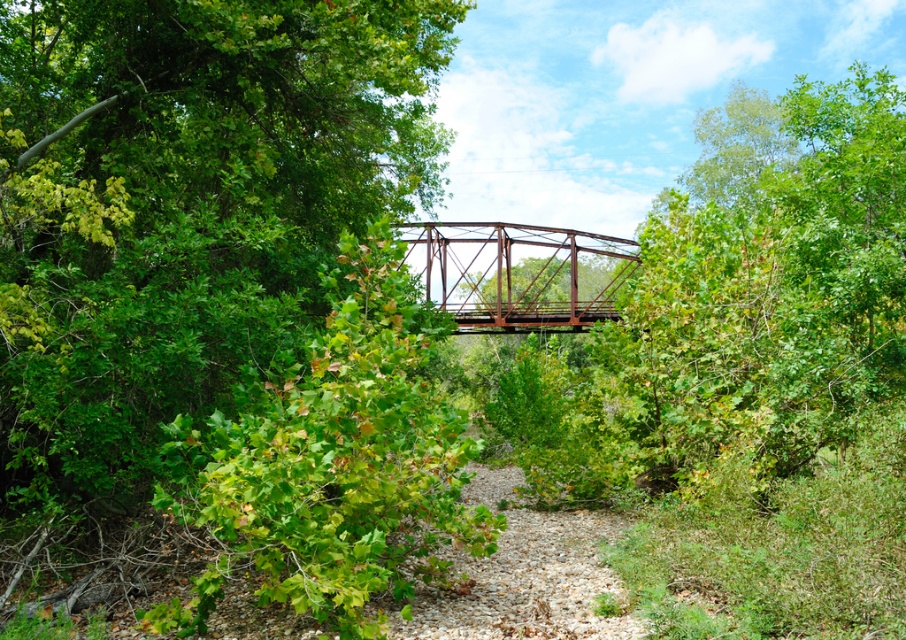
Which of these two, green leafy tree at upper left or rusty metal bridge at center, stands shorter?

rusty metal bridge at center

This screenshot has width=906, height=640. What do you see at coordinates (182, 209) in the screenshot?
I see `green leafy tree at upper left` at bounding box center [182, 209].

Image resolution: width=906 pixels, height=640 pixels. Find the location of `green leafy tree at upper left`. green leafy tree at upper left is located at coordinates (182, 209).